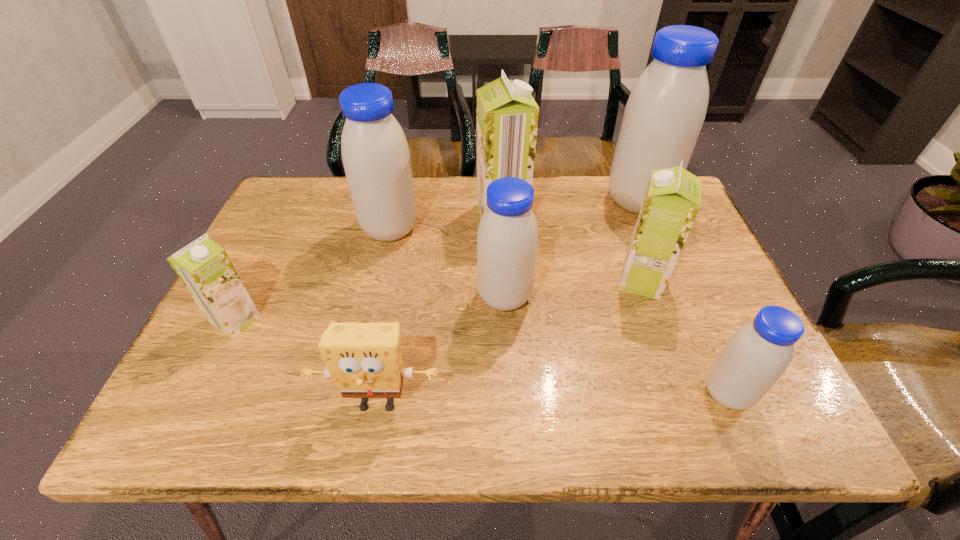
Locate an element on the screen. This screenshot has width=960, height=540. free space at the right edge of the desktop is located at coordinates (721, 330).

This screenshot has height=540, width=960. What are the coordinates of `vacant space that's between the second nearest blue soya milk and the leftmost object` in the screenshot? It's located at (371, 309).

The width and height of the screenshot is (960, 540). Find the location of `empty space that is in between the tallest soya milk and the leftmost object`. empty space that is in between the tallest soya milk and the leftmost object is located at coordinates (437, 261).

You are a GUI agent. You are given a task and a screenshot of the screen. Output one action in this format:
    pyautogui.click(x=<x>, y=<y>)
    Task: Click on the vacant area that lies between the sponge and the smallest blue soya milk
    
    Given the screenshot: What is the action you would take?
    pyautogui.click(x=552, y=398)

Image resolution: width=960 pixels, height=540 pixels. I want to click on vacant space in between the second smallest blue soya milk and the leftmost blue soya milk, so click(x=447, y=263).

Image resolution: width=960 pixels, height=540 pixels. In order to click on free area in between the biggest green soya milk and the sponge in this screenshot , I will do click(440, 309).

Identify the location of free area in between the smallest blue soya milk and the second green soya milk from left to right. The width and height of the screenshot is (960, 540). (614, 304).

Where is `vacant area between the nearest soya milk and the biggest blue soya milk`? The width and height of the screenshot is (960, 540). vacant area between the nearest soya milk and the biggest blue soya milk is located at coordinates (683, 298).

Find the location of a particular element. free point between the sponge and the leftmost soya milk is located at coordinates (307, 362).

Locate which object ranks third in proximity to the sponge. Please provide its 2D coordinates. Your answer should be formatted as a tuple, i.e. [(x, y)], where the tuple contains the x and y coordinates of a point satisfying the conditions above.

[(376, 158)]